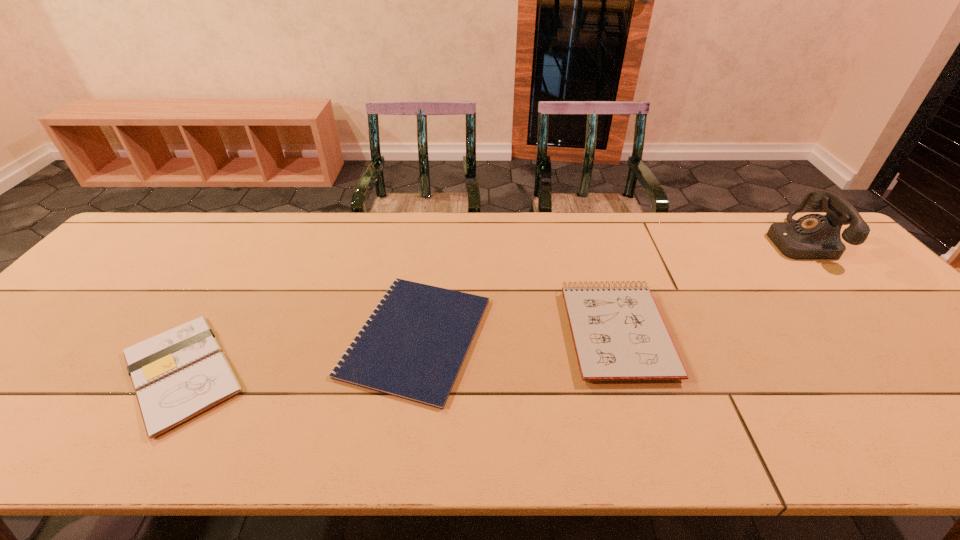
In order to click on free space located 0.180m on the back of the third object from left to right in this screenshot , I will do `click(590, 248)`.

Identify the location of vacant position located 0.230m on the back of the leftmost notepad. This screenshot has height=540, width=960. (251, 262).

Identify the location of vacant space located on the back of the third object from right to left. (428, 255).

At what (x,y) coordinates should I click in order to perform the action: click on object that is positioned at the far edge. Please return your answer as a coordinate pair (x, y). Looking at the image, I should click on (814, 236).

Where is `object present at the near edge`? The image size is (960, 540). object present at the near edge is located at coordinates (178, 374).

The width and height of the screenshot is (960, 540). In order to click on object present at the right edge in this screenshot , I will do `click(814, 236)`.

Find the location of a particular element. The width and height of the screenshot is (960, 540). object that is at the far right corner is located at coordinates (814, 236).

Locate an element on the screen. The image size is (960, 540). free space at the far edge is located at coordinates (588, 212).

I want to click on vacant space at the near edge of the desktop, so click(657, 433).

Locate an element on the screen. The height and width of the screenshot is (540, 960). free space at the left edge is located at coordinates point(94,328).